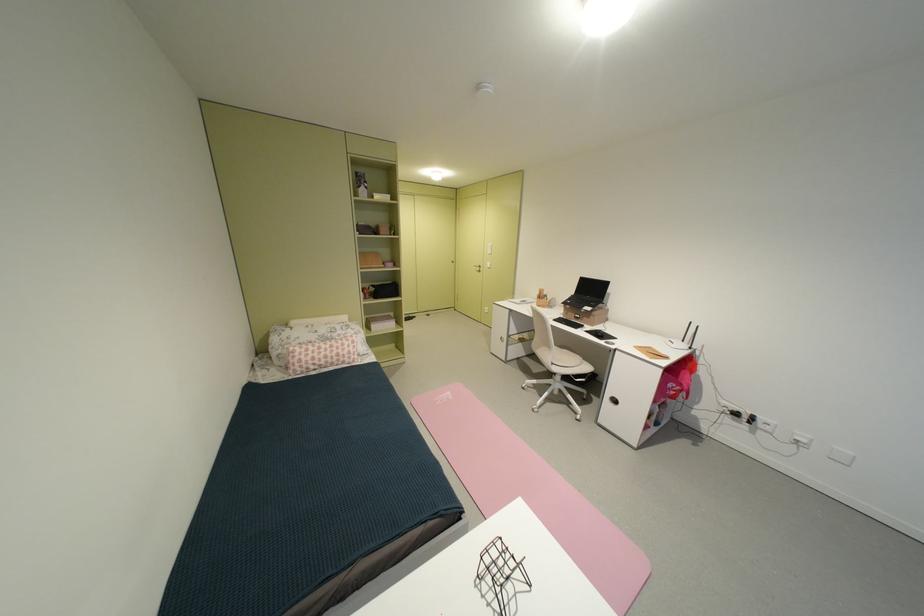
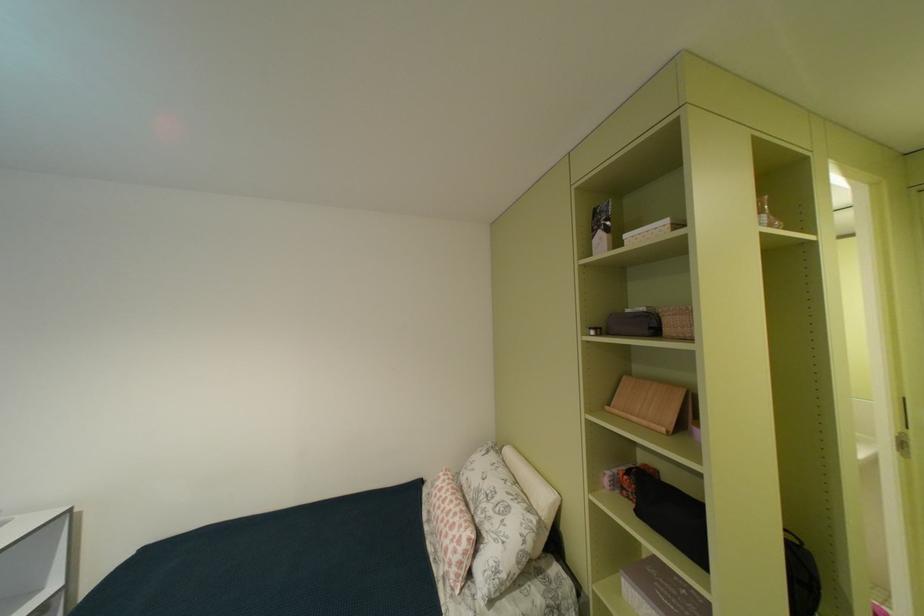
The point at (x=380, y=300) is marked in the first image. Where is the corresponding point in the second image?

(641, 501)